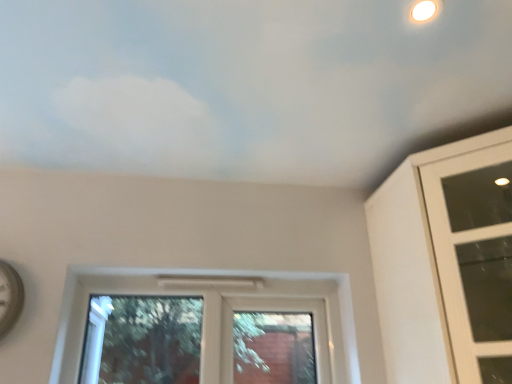
Question: Would you consider clear glass window at center, the 1th window viewed from the left, to be distant from white glass window at upper right, acting as the second window starting from the left?

Choices:
 (A) no
 (B) yes

Answer: (A)

Question: Is clear glass window at center, marked as the 2th window in a right-to-left arrangement, oriented towards white glass window at upper right, acting as the second window starting from the left?

Choices:
 (A) yes
 (B) no

Answer: (B)

Question: Considering the relative sizes of clear glass window at center, the 1th window viewed from the left, and white glass window at upper right, arranged as the first window when viewed from the right, in the image provided, is clear glass window at center, the 1th window viewed from the left, shorter than white glass window at upper right, arranged as the first window when viewed from the right,?

Choices:
 (A) no
 (B) yes

Answer: (B)

Question: Can you confirm if clear glass window at center, the 1th window viewed from the left, is wider than white glass window at upper right, arranged as the first window when viewed from the right?

Choices:
 (A) yes
 (B) no

Answer: (B)

Question: Can you confirm if clear glass window at center, the 1th window viewed from the left, is bigger than white glass window at upper right, acting as the second window starting from the left?

Choices:
 (A) yes
 (B) no

Answer: (B)

Question: Is clear glass window at center, marked as the 2th window in a right-to-left arrangement, bigger or smaller than white glass window at upper right, acting as the second window starting from the left?

Choices:
 (A) big
 (B) small

Answer: (B)

Question: In the image, is clear glass window at center, marked as the 2th window in a right-to-left arrangement, on the left side or the right side of white glass window at upper right, arranged as the first window when viewed from the right?

Choices:
 (A) left
 (B) right

Answer: (A)

Question: Does point (342, 306) appear closer or farther from the camera than point (438, 170)?

Choices:
 (A) closer
 (B) farther

Answer: (B)

Question: Is clear glass window at center, the 1th window viewed from the left, taller or shorter than white glass window at upper right, arranged as the first window when viewed from the right?

Choices:
 (A) tall
 (B) short

Answer: (B)

Question: Is point (504, 306) positioned closer to the camera than point (274, 61)?

Choices:
 (A) closer
 (B) farther

Answer: (B)

Question: From the image's perspective, relative to white matte cloud at upper center, is white glass window at upper right, arranged as the first window when viewed from the right, above or below?

Choices:
 (A) above
 (B) below

Answer: (B)

Question: Considering the relative positions of white glass window at upper right, acting as the second window starting from the left, and white matte cloud at upper center in the image provided, is white glass window at upper right, acting as the second window starting from the left, to the left or to the right of white matte cloud at upper center?

Choices:
 (A) right
 (B) left

Answer: (A)

Question: Is white glass window at upper right, acting as the second window starting from the left, situated inside white matte cloud at upper center or outside?

Choices:
 (A) outside
 (B) inside

Answer: (A)

Question: Does point (499, 261) appear closer or farther from the camera than point (346, 332)?

Choices:
 (A) closer
 (B) farther

Answer: (B)

Question: In terms of width, does white glass window at upper right, arranged as the first window when viewed from the right, look wider or thinner when compared to clear glass window at center, marked as the 2th window in a right-to-left arrangement?

Choices:
 (A) wide
 (B) thin

Answer: (A)